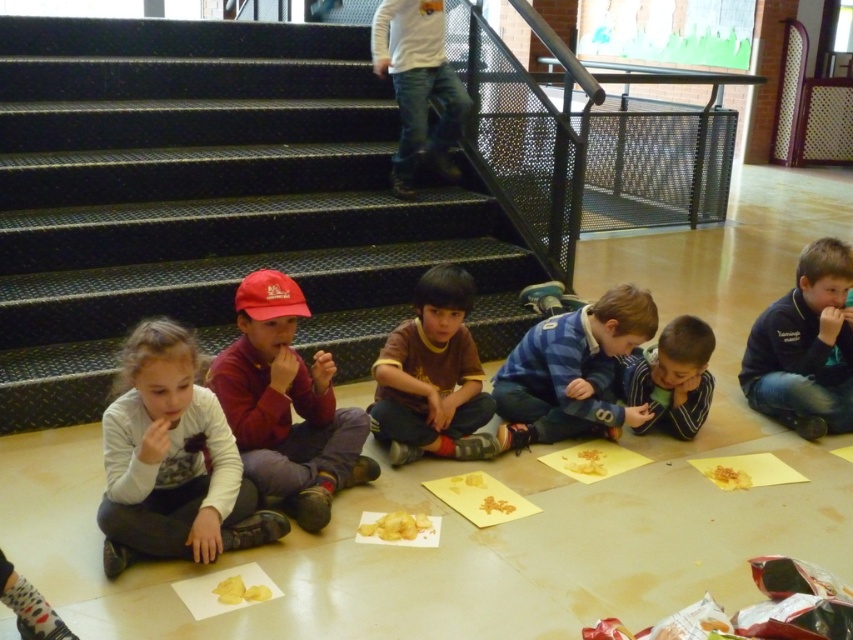
You are a teacher observing the children in the classroom. You notice the blue striped sweater at center and the yellow matte chips at center. Which object takes up more space in the scene?

The blue striped sweater at center is bigger than the yellow matte chips at center, so it takes up more space in the scene.

You are a child sitting at the center of the scene. You want to reach the yellow matte gingerbread man at lower center without moving your body. Can you do it if the brown soft shirt at center is in front of you?

The yellow matte gingerbread man at lower center is behind the brown soft shirt at center, so you cannot reach it without moving your body since the shirt is blocking the path.

You are a teacher observing the children during the activity. You need to ensure that all items are within reach. The brown soft shirt at center is in the middle of the children, and the yellow matte gingerbread man at lower center is near the edge. Considering their sizes, which item would require more space to move around?

The brown soft shirt at center requires more space to move around because its width surpasses that of the yellow matte gingerbread man at lower center.